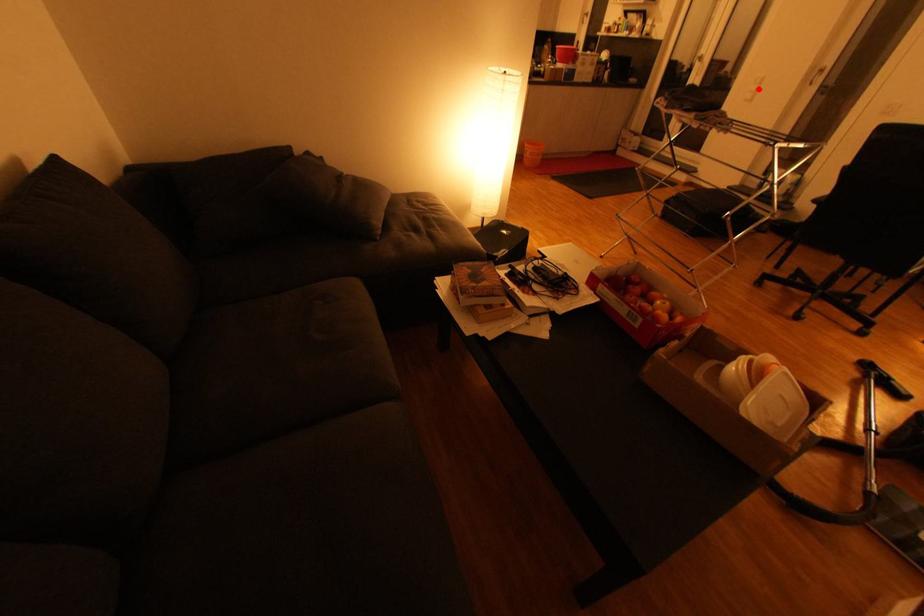
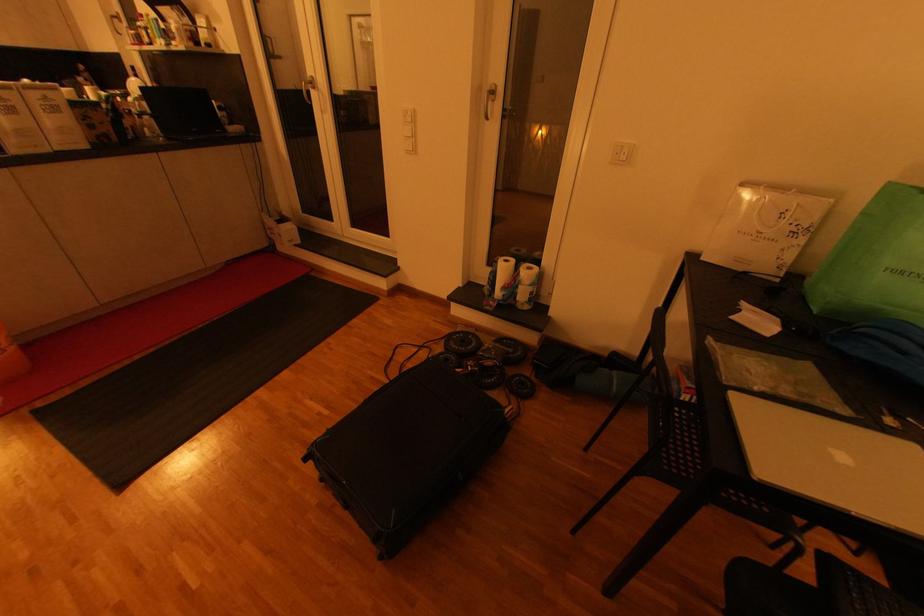
Question: I am providing you with two images of the same scene from different viewpoints. Image1 has a red point marked. In image2, the corresponding 3D location appears at what relative position? Reply with the corresponding letter.

Choices:
 (A) Closer
 (B) Farther

Answer: (A)